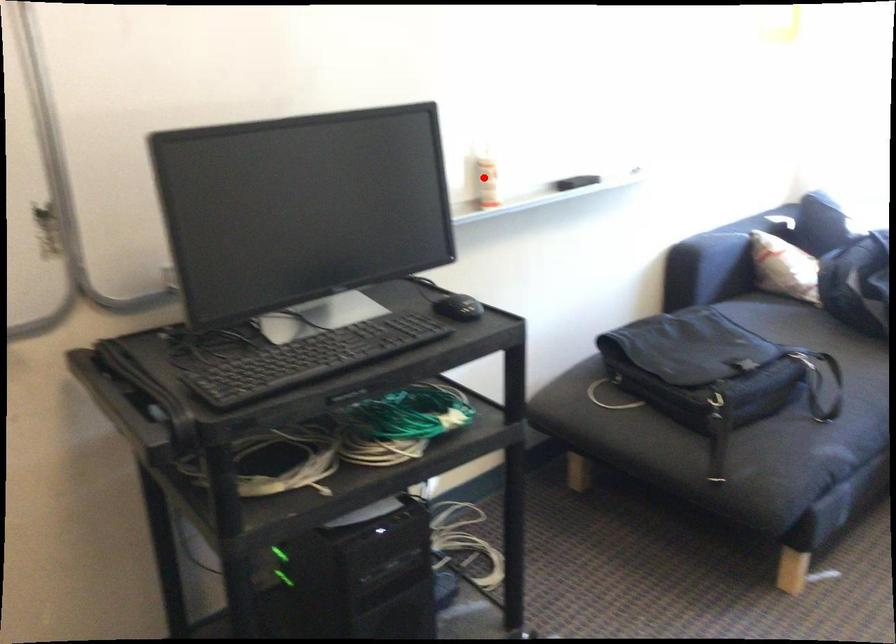
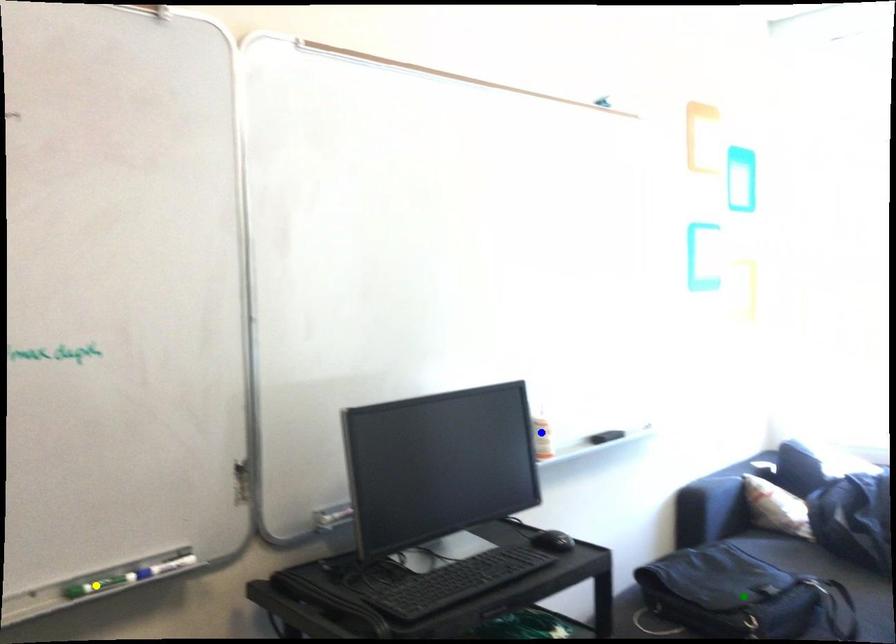
Question: I am providing you with two images of the same scene from different viewpoints. A red point is marked on the first image. You are given multiple points on the second image. Can you choose the point in image 2 that corresponds to the point in image 1?

Choices:
 (A) green point
 (B) blue point
 (C) yellow point

Answer: (B)